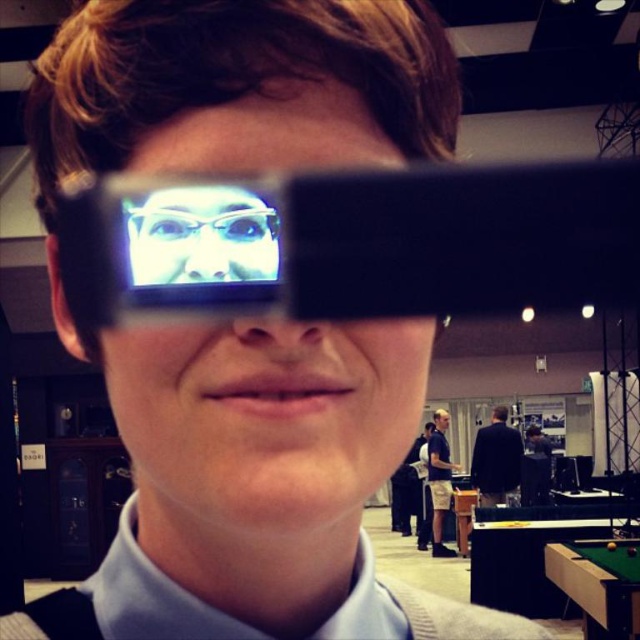
Question: Among these objects, which one is farthest from the camera?

Choices:
 (A) black glossy pool table at lower right
 (B) green felt billiard table at lower right
 (C) dark blue suit at center
 (D) blue glossy eye at center

Answer: (C)

Question: Which object is closer to the camera taking this photo?

Choices:
 (A) dark blue suit at center
 (B) khaki shorts at lower center

Answer: (A)

Question: Does black glossy pool table at lower right appear on the left side of dark blue suit at center?

Choices:
 (A) no
 (B) yes

Answer: (A)

Question: Is black glossy pool table at lower right above blue glossy eye at center?

Choices:
 (A) no
 (B) yes

Answer: (A)

Question: Does dark blue suit at center have a smaller size compared to khaki shorts at lower center?

Choices:
 (A) no
 (B) yes

Answer: (B)

Question: Among these points, which one is farthest from the camera?

Choices:
 (A) (172, 228)
 (B) (486, 458)

Answer: (B)